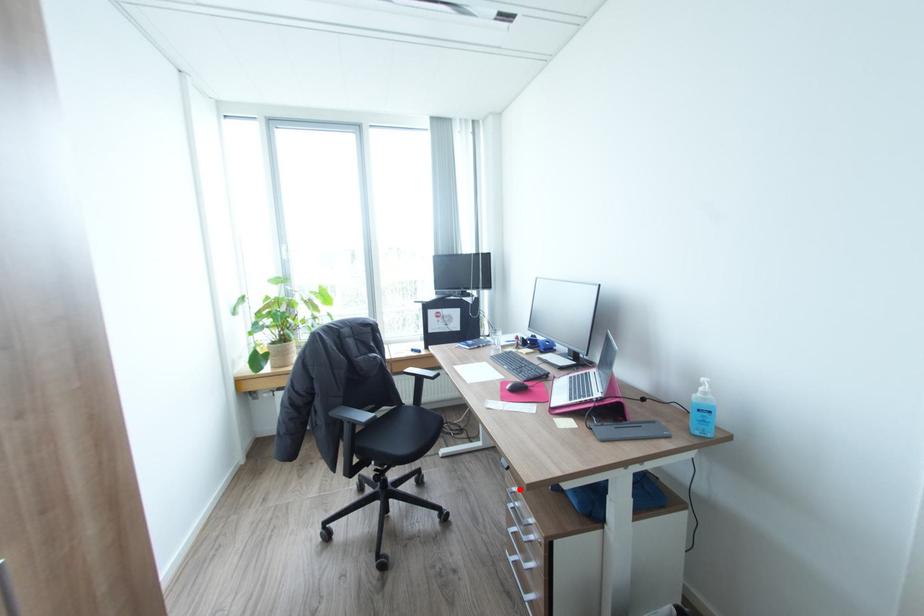
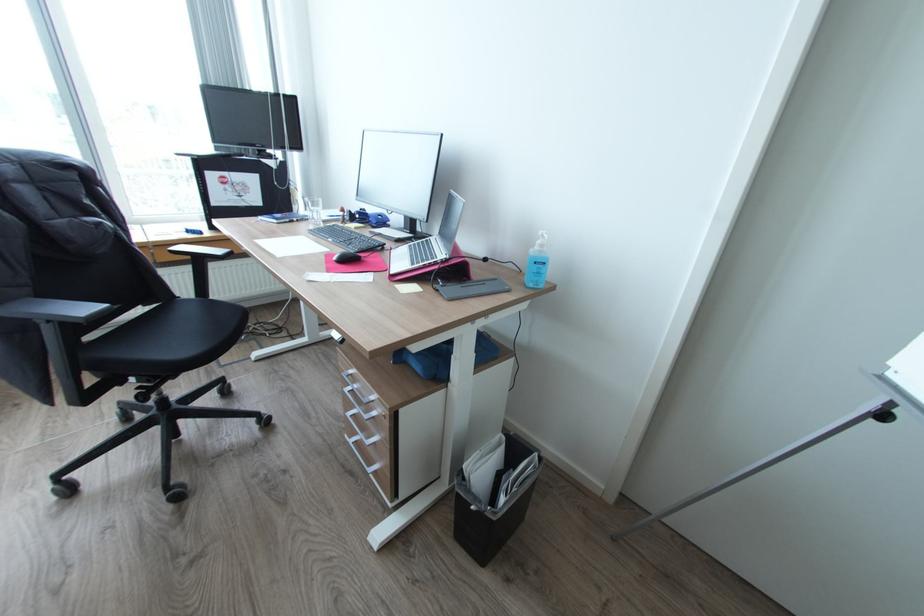
Locate, in the second image, the point that corresponds to the highlighted location in the first image.

(357, 371)